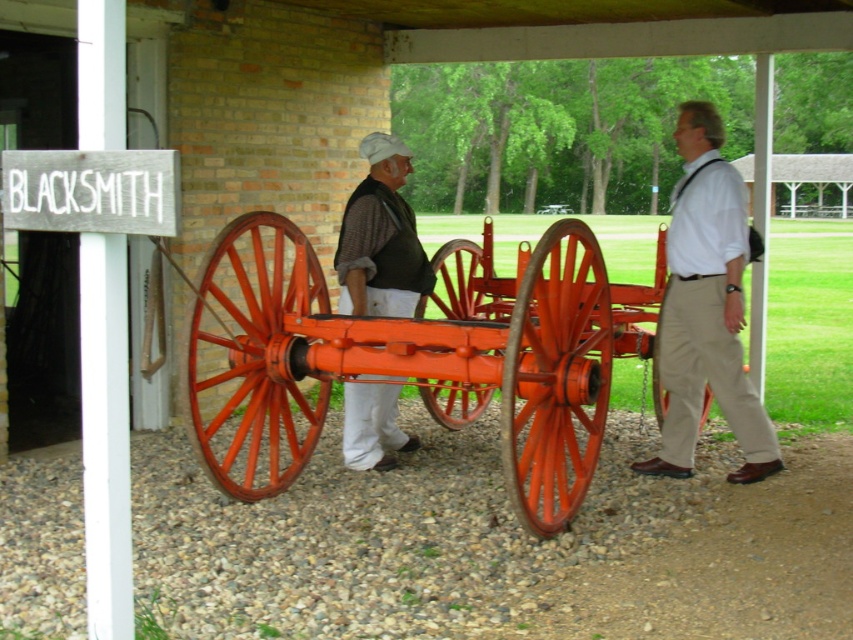
Which is above, orange polished wood cart at center or matte white shirt at right?

Positioned higher is matte white shirt at right.

Which is in front, point (601, 374) or point (721, 292)?

Point (601, 374)

You are a GUI agent. You are given a task and a screenshot of the screen. Output one action in this format:
    pyautogui.click(x=<x>, y=<y>)
    Task: Click on the orange polished wood cart at center
    Image resolution: width=853 pixels, height=640 pixels.
    Given the screenshot: What is the action you would take?
    pyautogui.click(x=408, y=358)

Is orange polished wood cart at center above matte brown vest at center?

No.

Does orange polished wood cart at center lie behind matte brown vest at center?

No, orange polished wood cart at center is closer to the viewer.

Between point (289, 307) and point (403, 268), which one is positioned behind?

The point (403, 268) is more distant.

Identify the location of orange polished wood cart at center. This screenshot has width=853, height=640. (408, 358).

Is the position of matte white shirt at right more distant than that of matte brown vest at center?

That is False.

Who is more forward, [746,436] or [346,221]?

Point [346,221] is in front.

Who is more forward, (657,340) or (387,236)?

Point (387,236) is in front.

Identify the location of matte white shirt at right. (706, 307).